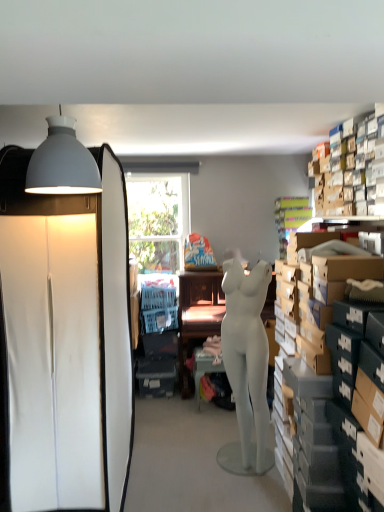
Question: From the image's perspective, is matte gray table at center beneath white matte cabinet at left?

Choices:
 (A) no
 (B) yes

Answer: (B)

Question: Can you confirm if matte gray table at center is wider than white matte cabinet at left?

Choices:
 (A) yes
 (B) no

Answer: (B)

Question: Does matte gray table at center have a greater height compared to white matte cabinet at left?

Choices:
 (A) no
 (B) yes

Answer: (A)

Question: From a real-world perspective, is matte gray table at center beneath white matte cabinet at left?

Choices:
 (A) no
 (B) yes

Answer: (B)

Question: Is matte gray table at center to the right of white matte cabinet at left from the viewer's perspective?

Choices:
 (A) yes
 (B) no

Answer: (A)

Question: From a real-world perspective, is matte gray table at center on white matte cabinet at left?

Choices:
 (A) no
 (B) yes

Answer: (A)

Question: Can you confirm if matte brown desk at center is thinner than white matte mannequin at center?

Choices:
 (A) yes
 (B) no

Answer: (B)

Question: Is matte brown desk at center wider than white matte mannequin at center?

Choices:
 (A) yes
 (B) no

Answer: (A)

Question: Is matte brown desk at center outside white matte mannequin at center?

Choices:
 (A) no
 (B) yes

Answer: (B)

Question: From a real-world perspective, is matte brown desk at center positioned under white matte mannequin at center based on gravity?

Choices:
 (A) yes
 (B) no

Answer: (A)

Question: Is white matte mannequin at center at the back of matte brown desk at center?

Choices:
 (A) no
 (B) yes

Answer: (A)

Question: Does matte brown desk at center contain white matte mannequin at center?

Choices:
 (A) no
 (B) yes

Answer: (A)

Question: Is matte brown desk at center far from matte gray lampshade at upper left?

Choices:
 (A) yes
 (B) no

Answer: (A)